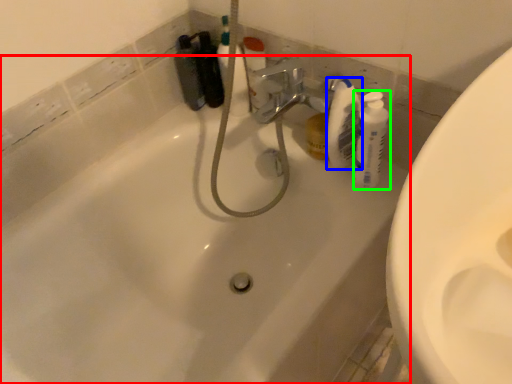
Question: Which object is positioned closest to bathtub (highlighted by a red box)? Select from cleaning product (highlighted by a blue box) and cleaning product (highlighted by a green box).

Choices:
 (A) cleaning product
 (B) cleaning product

Answer: (A)